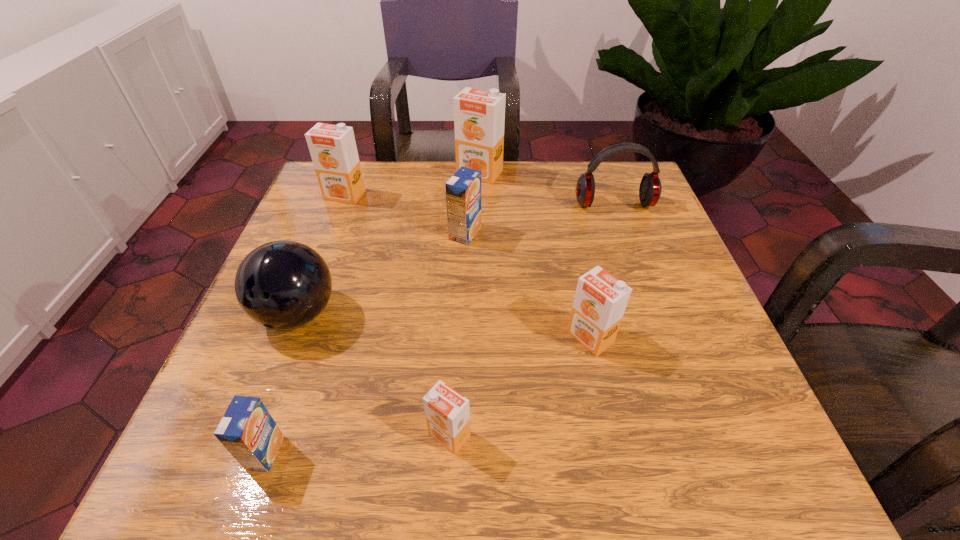
Locate an element on the screen. This screenshot has height=540, width=960. free point that satisfies the following two spatial constraints: 1. on the back side of the smallest orange orange juice; 2. on the right side of the smaller blue orange_juice is located at coordinates (272, 435).

You are a GUI agent. You are given a task and a screenshot of the screen. Output one action in this format:
    pyautogui.click(x=<x>, y=<y>)
    Task: Click on the free space that satisfies the following two spatial constraints: 1. on the side of the nearest orange orange juice with the finger holes; 2. on the left side of the black bowling ball
    This screenshot has width=960, height=540.
    Given the screenshot: What is the action you would take?
    pyautogui.click(x=252, y=435)

At what (x,y) coordinates should I click in order to perform the action: click on free location that satisfies the following two spatial constraints: 1. on the side of the bowling ball with the finger holes; 2. on the right side of the left blue orange_juice. Please return your answer as a coordinate pair (x, y). This screenshot has height=540, width=960. Looking at the image, I should click on (245, 453).

Identify the location of vacant area that satisfies the following two spatial constraints: 1. on the side of the left blue orange_juice with the finger holes; 2. on the left side of the bowling ball. The width and height of the screenshot is (960, 540). (245, 453).

Identify the location of free space that satisfies the following two spatial constraints: 1. on the front side of the leftmost orange orange juice; 2. on the right side of the nearer blue orange_juice. The height and width of the screenshot is (540, 960). (249, 453).